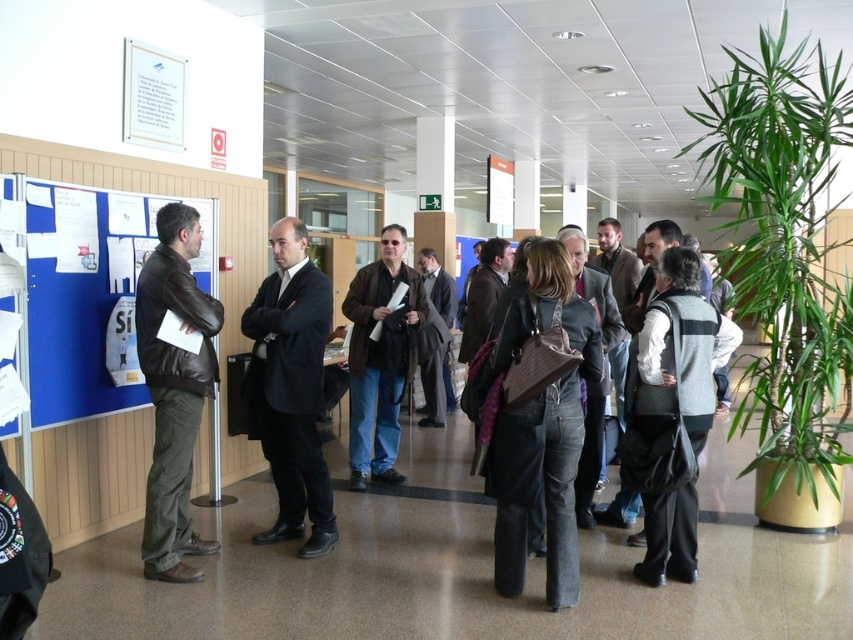
You are standing in the middle of the room and want to reach the white glossy poster at upper left. Which direction should you move to get there?

The white glossy poster at upper left is located at point [154,97], so you should move towards the upper left direction to reach it.

You are standing at the entrance of the room and notice two points marked in the scene. The first point is at coordinates point (138,132) and the second at point (509,163). Which point is closer to you?

Point (138,132) is in front of point (509,163), so it is closer to you.